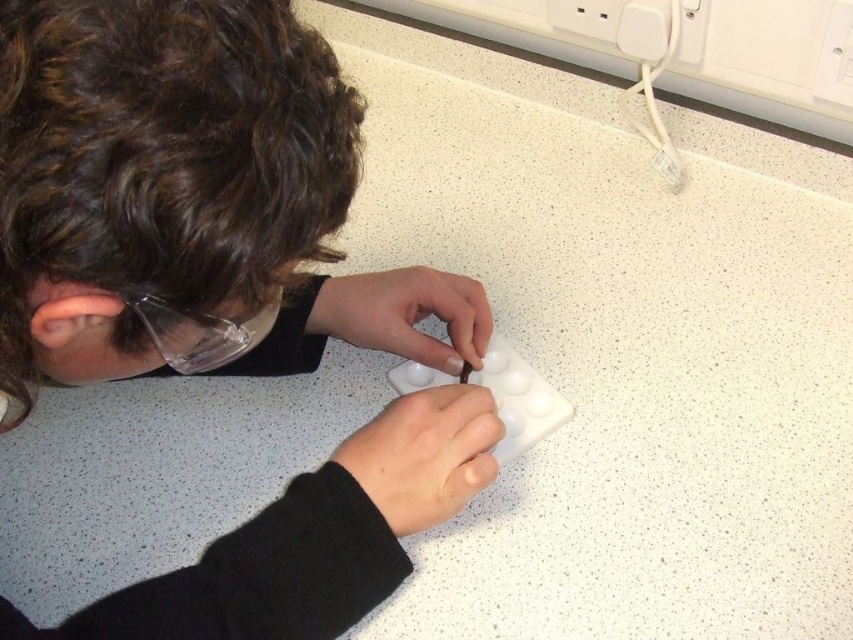
You are a pharmacist preparing a prescription for a patient. You have a white matte pill container at lower center at point (424, 454). Where should you place the container so that it is exactly 2 centimeters to the left of its current position?

To place the white matte pill container at lower center exactly 2 centimeters to the left of its current position at point (424, 454), you would move it to the coordinate point calculated by subtracting 2 centimeters from the current x coordinate. However, without knowing the scale of the coordinate system, an exact coordinate cannot be determined. The new position would be 2 cm left along the horizontal axis from point (424, 454).

You are a pharmacist preparing medication for a patient. You have a white matte pill container at lower center and a white matte pill box at center on your counter. Which one do you need to place higher to prevent the shorter one from being hidden behind it?

The white matte pill container at lower center is taller than the white matte pill box at center. To prevent the shorter pill box from being hidden, place the taller pill container higher so it doesn

You are a pharmacist preparing medication for a patient. You have a white matte pill container at lower center and a white matte pill box at center. Which one is closer to you?

The white matte pill container at lower center is closer to you because it is in front of the white matte pill box at center.